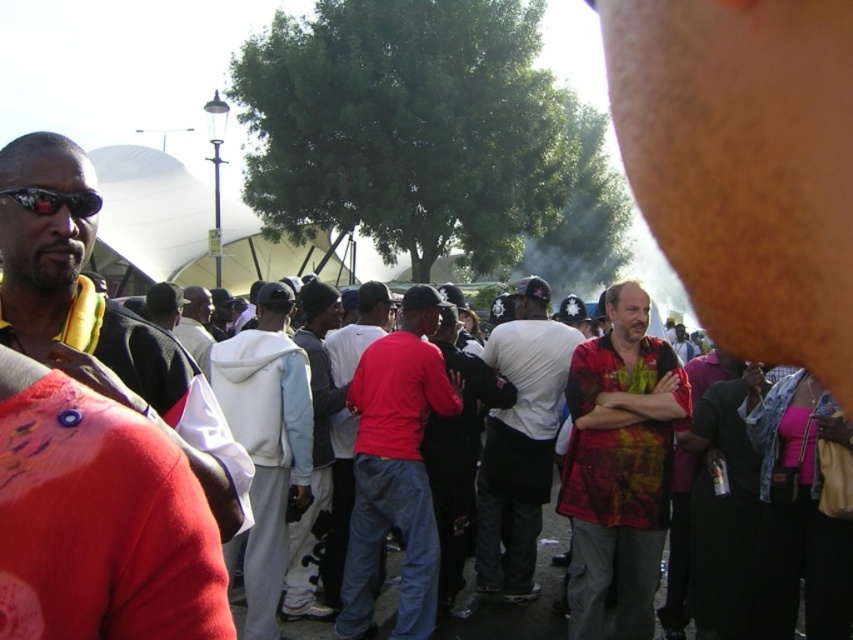
Based on the photo, is matte red shirt at center taller than red hoodie at center?

No, matte red shirt at center is not taller than red hoodie at center.

The width and height of the screenshot is (853, 640). I want to click on matte red shirt at center, so click(338, 506).

Describe the element at coordinates (338, 506) in the screenshot. I see `matte red shirt at center` at that location.

What are the coordinates of `matte red shirt at center` in the screenshot? It's located at (338, 506).

Between point (370, 360) and point (544, 474), which one is positioned in front?

Point (370, 360) is more forward.

Can you confirm if red matte shirt at center is thinner than white matte shirt at center?

Yes, red matte shirt at center is thinner than white matte shirt at center.

The image size is (853, 640). I want to click on red matte shirt at center, so click(x=395, y=468).

The image size is (853, 640). In order to click on red matte shirt at center in this screenshot , I will do `click(395, 468)`.

Can you confirm if red matte shirt at center is positioned above matte black sunglasses at left?

Incorrect, red matte shirt at center is not positioned above matte black sunglasses at left.

Is red matte shirt at center shorter than matte black sunglasses at left?

In fact, red matte shirt at center may be taller than matte black sunglasses at left.

Who is more forward, (x=405, y=616) or (x=27, y=188)?

Positioned in front is point (x=27, y=188).

I want to click on red matte shirt at center, so click(x=395, y=468).